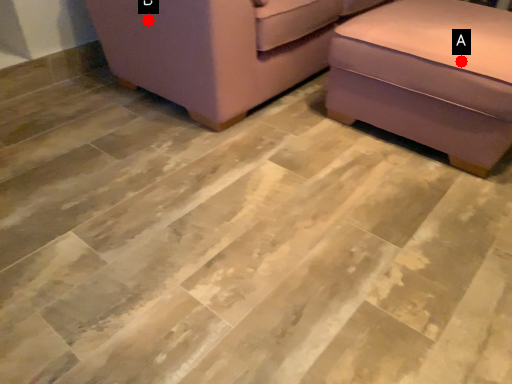
Question: Two points are circled on the image, labeled by A and B beside each circle. Among these points, which one is farthest from the camera?

Choices:
 (A) A is further
 (B) B is further

Answer: (B)